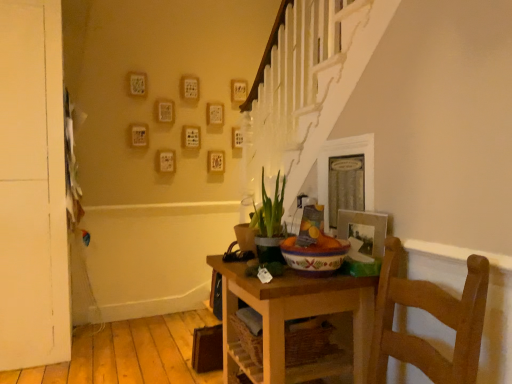
At what (x,y) coordinates should I click in order to perform the action: click on metallic silver photo frame at upper right. Please return your answer as a coordinate pair (x, y). Looking at the image, I should click on pos(364,230).

Measure the distance between white matte door at left and camera.

white matte door at left is 2.66 meters away from camera.

Image resolution: width=512 pixels, height=384 pixels. What are the coordinates of `green matte plant at center` in the screenshot? It's located at (269, 222).

Can you confirm if white matte door at left is bigger than wooden table at center?

Yes.

From a real-world perspective, who is located lower, white matte door at left or wooden table at center?

wooden table at center is physically lower.

Does point (49, 342) lie in front of point (233, 360)?

No, (49, 342) is behind (233, 360).

Considering the relative positions of metallic silver photo frame at upper right and white matte door at left in the image provided, is metallic silver photo frame at upper right to the left or to the right of white matte door at left?

In the image, metallic silver photo frame at upper right appears on the right side of white matte door at left.

Does point (355, 216) come behind point (20, 281)?

No, it is in front of (20, 281).

Is metallic silver photo frame at upper right facing away from white matte door at left?

metallic silver photo frame at upper right is not turned away from white matte door at left.

How different are the orientations of metallic silver photo frame at upper right and white matte door at left in degrees?

There is a 87.3-degree angle between the facing directions of metallic silver photo frame at upper right and white matte door at left.

Is wooden table at center not near white matte door at left?

Yes, wooden table at center is far from white matte door at left.

Which object is wider, wooden table at center or white matte door at left?

white matte door at left is wider.

From the picture: Is wooden table at center situated inside white matte door at left or outside?

wooden table at center lies outside white matte door at left.

From a real-world perspective, between wooden table at center and white matte door at left, who is vertically higher?

In real-world perspective, white matte door at left is above.

Consider the image. From a real-world perspective, is green matte plant at center physically located above or below wooden table at center?

Clearly, from a real-world perspective, green matte plant at center is above wooden table at center.

Who is shorter, green matte plant at center or wooden table at center?

Standing shorter between the two is green matte plant at center.

Is green matte plant at center thinner than wooden table at center?

Correct, the width of green matte plant at center is less than that of wooden table at center.

Is point (267, 210) more distant than point (360, 224)?

Yes, it is.

Is green matte plant at center positioned far away from metallic silver photo frame at upper right?

green matte plant at center is near metallic silver photo frame at upper right, not far away.

Considering the relative positions of green matte plant at center and metallic silver photo frame at upper right in the image provided, is green matte plant at center behind metallic silver photo frame at upper right?

Yes, it is behind metallic silver photo frame at upper right.

Which of these two, wooden table at center or green matte plant at center, stands taller?

With more height is wooden table at center.

Which of these two, wooden table at center or green matte plant at center, is wider?

wooden table at center.

Based on the photo, do you think wooden table at center is within green matte plant at center, or outside of it?

The correct answer is: outside.

From the image's perspective, between wooden table at center and green matte plant at center, which one is located above?

green matte plant at center.

From the image's perspective, which is above, wooden table at center or metallic silver photo frame at upper right?

metallic silver photo frame at upper right is shown above in the image.

Does point (225, 369) come farther from viewer compared to point (341, 226)?

That is True.

Is wooden table at center oriented towards metallic silver photo frame at upper right?

No, wooden table at center does not turn towards metallic silver photo frame at upper right.

Find the location of a particular element. table in front of the white matte door at left is located at coordinates (294, 318).

In the image, there is a metallic silver photo frame at upper right. Where is `door above it (from the image's perspective)`? door above it (from the image's perspective) is located at coordinates click(32, 188).

When comparing their distances from metallic silver photo frame at upper right, does wooden table at center or white matte door at left seem further?

white matte door at left is positioned further to the anchor metallic silver photo frame at upper right.

Considering their positions, is wooden table at center positioned further to green matte plant at center than metallic silver photo frame at upper right?

metallic silver photo frame at upper right is further to green matte plant at center.

From the image, which object appears to be farther from green matte plant at center, wooden table at center or white matte door at left?

Answer: white matte door at left is positioned further to the anchor green matte plant at center.

Considering their positions, is green matte plant at center positioned closer to white matte door at left than wooden table at center?

Among the two, green matte plant at center is located nearer to white matte door at left.

Which object lies nearer to the anchor point white matte door at left, metallic silver photo frame at upper right or green matte plant at center?

The object closer to white matte door at left is green matte plant at center.

Based on their spatial positions, is white matte door at left or metallic silver photo frame at upper right closer to green matte plant at center?

metallic silver photo frame at upper right is closer to green matte plant at center.

In the scene shown: When comparing their distances from green matte plant at center, does white matte door at left or wooden table at center seem closer?

Based on the image, wooden table at center appears to be nearer to green matte plant at center.

When comparing their distances from wooden table at center, does metallic silver photo frame at upper right or white matte door at left seem further?

white matte door at left.

What are the coordinates of `picture frame between green matte plant at center and wooden table at center in the vertical direction` in the screenshot? It's located at (364, 230).

The height and width of the screenshot is (384, 512). I want to click on table between white matte door at left and metallic silver photo frame at upper right, so click(294, 318).

This screenshot has width=512, height=384. Identify the location of houseplant between white matte door at left and metallic silver photo frame at upper right. (269, 222).

Find the location of a particular element. Image resolution: width=512 pixels, height=384 pixels. houseplant between white matte door at left and wooden table at center in the horizontal direction is located at coordinates (269, 222).